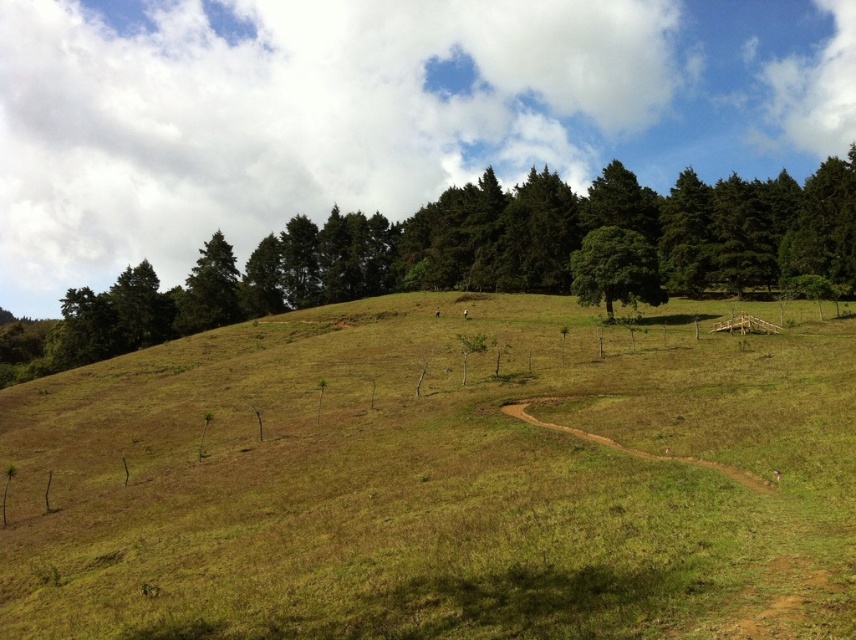
You are standing on the green grassy hillside at center and want to reach the green leafy tree at upper center. Which direction should you walk to get closer to the tree?

You should walk upwards because the green leafy tree at upper center is located higher on the hill than the green grassy hillside at center.

You are standing at the bottom of the hill and want to walk towards the green leafy tree at center. Which direction should you go relative to the green grassy hillside at center?

The green grassy hillside at center is closer to you, so to reach the green leafy tree at center, you should walk towards the direction away from the green grassy hillside at center.